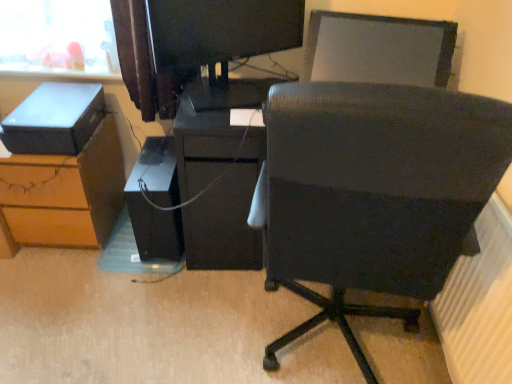
At what (x,y) coordinates should I click in order to perform the action: click on matte black desk at center. Please return your answer as a coordinate pair (x, y). Looking at the image, I should click on (220, 173).

This screenshot has height=384, width=512. Describe the element at coordinates (54, 119) in the screenshot. I see `matte black storage box at left` at that location.

The height and width of the screenshot is (384, 512). What do you see at coordinates (479, 305) in the screenshot? I see `white textured radiator at lower right` at bounding box center [479, 305].

The image size is (512, 384). What are the coordinates of `matte black monitor at upper center` in the screenshot? It's located at (223, 43).

Locate an element on the screen. matte black desk at center is located at coordinates (220, 173).

How different are the orientations of black fabric chair at center and black matte computer tower at center in degrees?

172 degrees separate the facing orientations of black fabric chair at center and black matte computer tower at center.

Is black fabric chair at center bigger or smaller than black matte computer tower at center?

black fabric chair at center is bigger than black matte computer tower at center.

This screenshot has height=384, width=512. In order to click on computer tower below the black fabric chair at center (from a real-world perspective) in this screenshot , I will do `click(155, 201)`.

Is black matte computer tower at center oriented away from matte black storage box at left?

black matte computer tower at center is not turned away from matte black storage box at left.

Is black matte computer tower at center placed right next to matte black storage box at left?

No, black matte computer tower at center is not next to matte black storage box at left.

Based on the photo, is the position of black matte computer tower at center less distant than that of matte black storage box at left?

No, it is behind matte black storage box at left.

From the image's perspective, is black matte computer tower at center below matte black storage box at left?

Yes, from the image's perspective, black matte computer tower at center is beneath matte black storage box at left.

Is there a large distance between black matte computer tower at center and matte black desk at center?

They are positioned close to each other.

Which is in front, black matte computer tower at center or matte black desk at center?

matte black desk at center is closer to the camera.

Is black matte computer tower at center wider than matte black desk at center?

In fact, black matte computer tower at center might be narrower than matte black desk at center.

Is black matte computer tower at center to the right of matte black desk at center from the viewer's perspective?

No.

Is matte black desk at center surrounding black fabric chair at center?

No, black fabric chair at center is not inside matte black desk at center.

In the scene shown: Between matte black desk at center and black fabric chair at center, which one has smaller size?

matte black desk at center is smaller.

Can you tell me how much matte black desk at center and black fabric chair at center differ in facing direction?

172 degrees separate the facing orientations of matte black desk at center and black fabric chair at center.

Looking at the image, does matte black monitor at upper center seem bigger or smaller compared to brown wood desk at lower left?

Considering their sizes, matte black monitor at upper center takes up less space than brown wood desk at lower left.

From a real-world perspective, is matte black monitor at upper center positioned above or below brown wood desk at lower left?

In terms of real-world spatial position, matte black monitor at upper center is above brown wood desk at lower left.

Which object is further away from the camera taking this photo, matte black monitor at upper center or brown wood desk at lower left?

Positioned behind is brown wood desk at lower left.

Would you say matte black monitor at upper center is outside brown wood desk at lower left?

matte black monitor at upper center lies outside brown wood desk at lower left's area.

From the image's perspective, is white textured radiator at lower right located above or below black matte computer tower at center?

Clearly, from the image's perspective, white textured radiator at lower right is below black matte computer tower at center.

Who is taller, white textured radiator at lower right or black matte computer tower at center?

white textured radiator at lower right is taller.

Looking at their sizes, would you say white textured radiator at lower right is wider or thinner than black matte computer tower at center?

white textured radiator at lower right is thinner than black matte computer tower at center.

Does point (161, 29) lie behind point (165, 163)?

No, it is not.

From the image's perspective, would you say matte black monitor at upper center is positioned over black matte computer tower at center?

Yes, from the image's perspective, matte black monitor at upper center is on top of black matte computer tower at center.

Which object is more forward, matte black monitor at upper center or black matte computer tower at center?

matte black monitor at upper center is closer to the camera.

What are the coordinates of `computer tower below the black fabric chair at center (from a real-world perspective)` in the screenshot? It's located at (155, 201).

The image size is (512, 384). Find the location of `storage box above the black matte computer tower at center (from the image's perspective)`. storage box above the black matte computer tower at center (from the image's perspective) is located at coordinates (54, 119).

Looking at the image, which one is located closer to matte black monitor at upper center, matte black desk at center or black matte computer tower at center?

matte black desk at center is closer to matte black monitor at upper center.

Based on their spatial positions, is white textured radiator at lower right or matte black desk at center further from black matte computer tower at center?

Among the two, white textured radiator at lower right is located further to black matte computer tower at center.

Estimate the real-world distances between objects in this image. Which object is further from brown wood desk at lower left, matte black storage box at left or black fabric chair at center?

Based on the image, black fabric chair at center appears to be further to brown wood desk at lower left.

Estimate the real-world distances between objects in this image. Which object is further from matte black storage box at left, black matte computer tower at center or matte black desk at center?

matte black desk at center lies further to matte black storage box at left than the other object.

Based on their spatial positions, is matte black storage box at left or black fabric chair at center further from black matte computer tower at center?

Based on the image, black fabric chair at center appears to be further to black matte computer tower at center.

From the image, which object appears to be nearer to brown wood desk at lower left, black matte computer tower at center or white textured radiator at lower right?

Among the two, black matte computer tower at center is located nearer to brown wood desk at lower left.

In the scene shown: Based on their spatial positions, is matte black monitor at upper center or brown wood desk at lower left closer to black fabric chair at center?

Among the two, matte black monitor at upper center is located nearer to black fabric chair at center.

Based on their spatial positions, is white textured radiator at lower right or black matte computer tower at center further from matte black monitor at upper center?

Based on the image, white textured radiator at lower right appears to be further to matte black monitor at upper center.

At what (x,y) coordinates should I click in order to perform the action: click on desktop computer between black fabric chair at center and matte black desk at center from front to back. Please return your answer as a coordinate pair (x, y). The height and width of the screenshot is (384, 512). Looking at the image, I should click on (223, 43).

The height and width of the screenshot is (384, 512). What are the coordinates of `storage box between brown wood desk at lower left and matte black desk at center in the horizontal direction` in the screenshot? It's located at (54, 119).

You are a GUI agent. You are given a task and a screenshot of the screen. Output one action in this format:
    pyautogui.click(x=<x>, y=<y>)
    Task: Click on the desktop computer located between brown wood desk at lower left and black fabric chair at center in the left-right direction
    
    Given the screenshot: What is the action you would take?
    pyautogui.click(x=223, y=43)

The height and width of the screenshot is (384, 512). In order to click on desktop computer between black fabric chair at center and black matte computer tower at center along the z-axis in this screenshot , I will do `click(223, 43)`.